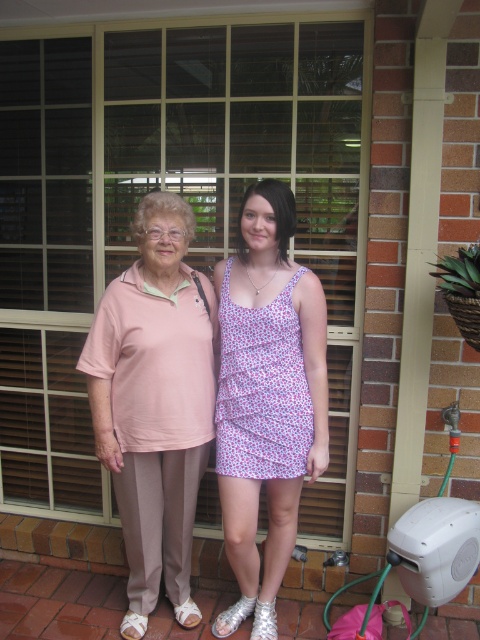
Question: Which point is farther from the camera taking this photo?

Choices:
 (A) (222, 397)
 (B) (136, 419)

Answer: (A)

Question: Is pink fabric shirt at left further to the viewer compared to pink floral fabric dress at center?

Choices:
 (A) yes
 (B) no

Answer: (A)

Question: Which point appears farthest from the camera in this image?

Choices:
 (A) (228, 452)
 (B) (292, 506)

Answer: (B)

Question: Is matte pink blouse at left behind pink floral fabric dress at center?

Choices:
 (A) no
 (B) yes

Answer: (A)

Question: Is matte pink blouse at left wider than pink floral fabric dress at center?

Choices:
 (A) yes
 (B) no

Answer: (A)

Question: Among these objects, which one is farthest from the camera?

Choices:
 (A) matte pink blouse at left
 (B) pink fabric shirt at left

Answer: (B)